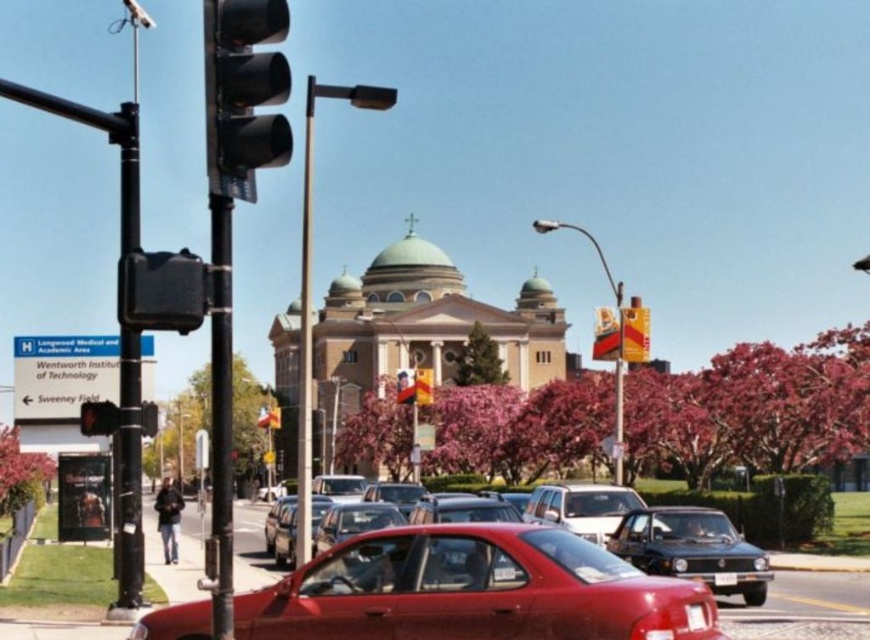
Question: Can you confirm if black matte traffic light at left is smaller than shiny black sedan at center?

Choices:
 (A) no
 (B) yes

Answer: (A)

Question: Which of the following is the closest to the observer?

Choices:
 (A) (315, 605)
 (B) (276, 122)
 (C) (306, 205)
 (D) (755, 596)

Answer: (B)

Question: Which object is farther from the camera taking this photo?

Choices:
 (A) black plastic traffic light at left
 (B) metallic pole at center
 (C) shiny black sedan at center

Answer: (C)

Question: Does black matte traffic light at left have a smaller size compared to shiny black sedan at center?

Choices:
 (A) no
 (B) yes

Answer: (A)

Question: Which of these objects is positioned closest to the shiny red sedan at center?

Choices:
 (A) glossy red sedan at center
 (B) shiny black sedan at center
 (C) black plastic traffic light at left
 (D) black matte traffic light at left

Answer: (B)

Question: Does metallic pole at center appear on the right side of black plastic traffic light at left?

Choices:
 (A) yes
 (B) no

Answer: (A)